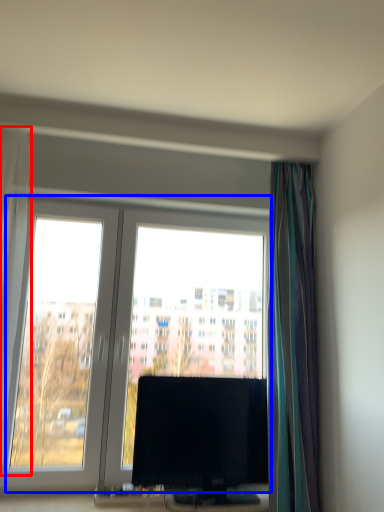
Question: Which point is closer to the camera, curtain (highlighted by a red box) or window (highlighted by a blue box)?

Choices:
 (A) curtain
 (B) window

Answer: (A)